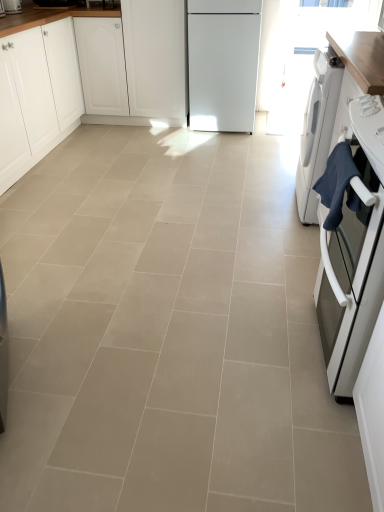
Question: From the image's perspective, is beige ceramic tile at center under matte white toaster at upper left?

Choices:
 (A) no
 (B) yes

Answer: (B)

Question: From the image's perspective, is beige ceramic tile at center located above matte white toaster at upper left?

Choices:
 (A) no
 (B) yes

Answer: (A)

Question: Does beige ceramic tile at center come behind matte white toaster at upper left?

Choices:
 (A) yes
 (B) no

Answer: (B)

Question: Is beige ceramic tile at center oriented towards matte white toaster at upper left?

Choices:
 (A) yes
 (B) no

Answer: (B)

Question: Does beige ceramic tile at center have a greater height compared to matte white toaster at upper left?

Choices:
 (A) no
 (B) yes

Answer: (A)

Question: Looking at their shapes, would you say beige ceramic tile at center is wider or thinner than white matte cabinet at center, the first cabinetry in the right-to-left sequence?

Choices:
 (A) wide
 (B) thin

Answer: (A)

Question: Which is correct: beige ceramic tile at center is inside white matte cabinet at center, the first cabinetry in the right-to-left sequence, or outside of it?

Choices:
 (A) outside
 (B) inside

Answer: (A)

Question: Is point (109, 245) positioned closer to the camera than point (173, 76)?

Choices:
 (A) closer
 (B) farther

Answer: (A)

Question: Is beige ceramic tile at center taller or shorter than white matte cabinet at center, the first cabinetry in the right-to-left sequence?

Choices:
 (A) tall
 (B) short

Answer: (B)

Question: Is white matte cabinet at left, placed as the 1th cabinetry when sorted from left to right, in front of or behind beige ceramic tile at center in the image?

Choices:
 (A) behind
 (B) front

Answer: (A)

Question: Is point (19, 70) positioned closer to the camera than point (213, 400)?

Choices:
 (A) farther
 (B) closer

Answer: (A)

Question: From a real-world perspective, is white matte cabinet at left, placed as the 2th cabinetry when sorted from right to left, above or below beige ceramic tile at center?

Choices:
 (A) below
 (B) above

Answer: (B)

Question: Is white matte cabinet at left, placed as the 1th cabinetry when sorted from left to right, bigger or smaller than beige ceramic tile at center?

Choices:
 (A) small
 (B) big

Answer: (B)

Question: From the image's perspective, is matte white toaster at upper left positioned above or below beige ceramic tile at center?

Choices:
 (A) above
 (B) below

Answer: (A)

Question: In the image, is matte white toaster at upper left on the left side or the right side of beige ceramic tile at center?

Choices:
 (A) right
 (B) left

Answer: (B)